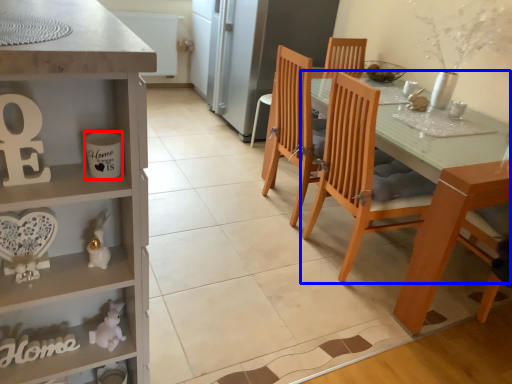
Question: Which of the following is the closest to the observer, coffee cup (highlighted by a red box) or chair (highlighted by a blue box)?

Choices:
 (A) coffee cup
 (B) chair

Answer: (A)